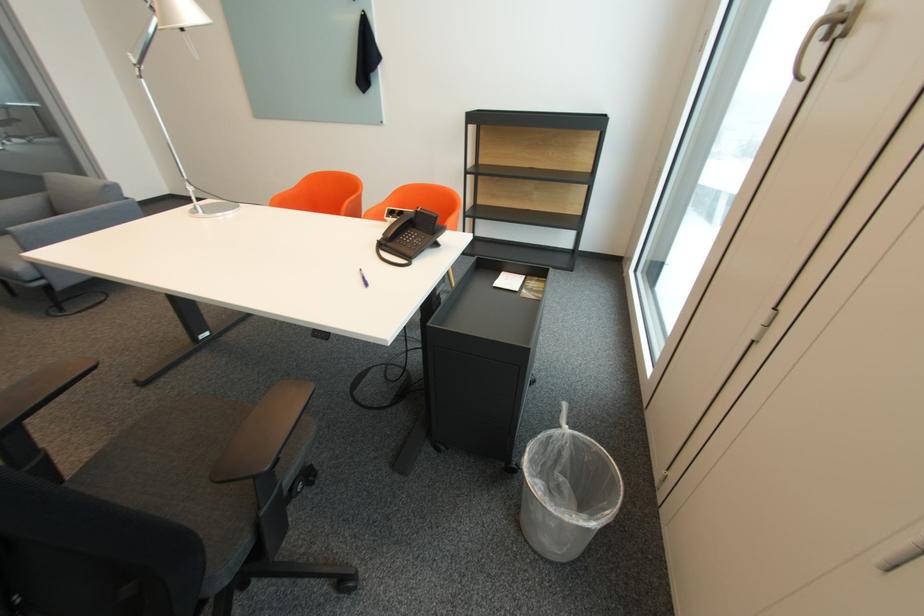
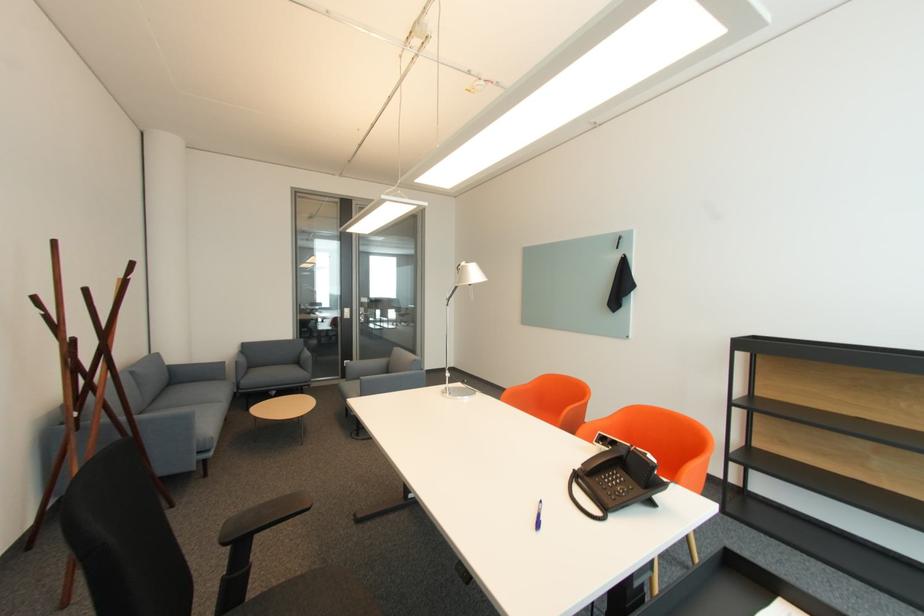
First-person continuous shooting, in which direction is the camera rotating?

The camera rotated toward left-up.